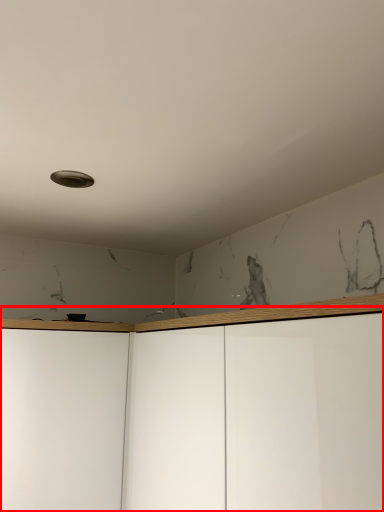
Question: From the image's perspective, considering the relative positions of dresser (annotated by the red box) and glass door in the image provided, where is dresser (annotated by the red box) located with respect to the staircase?

Choices:
 (A) below
 (B) above

Answer: (B)